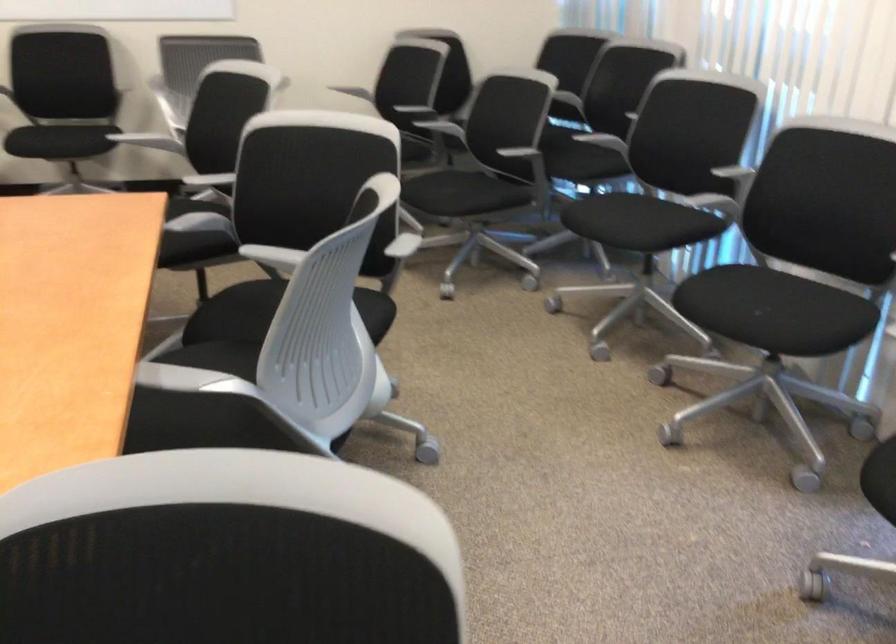
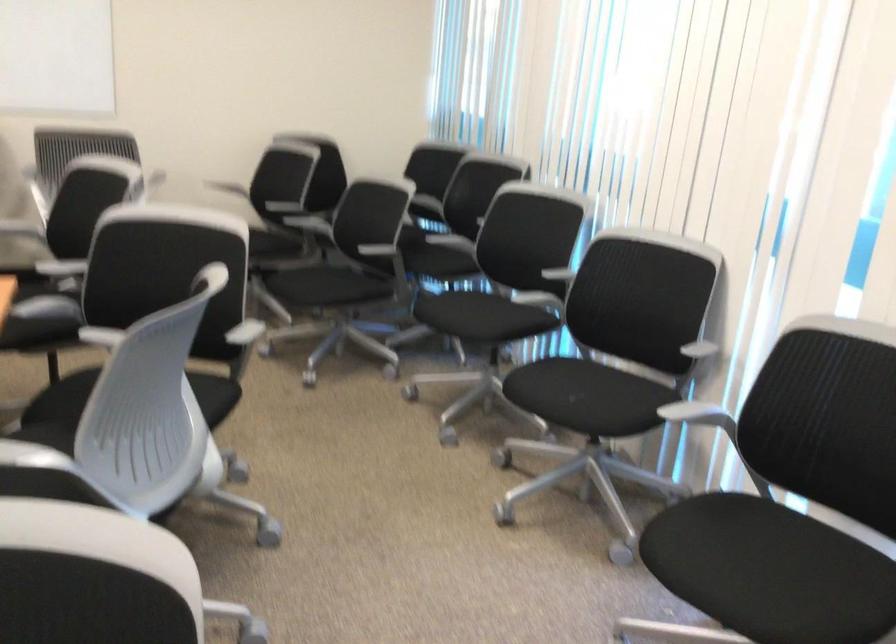
Question: How did the camera likely rotate?

Choices:
 (A) Left
 (B) Right
 (C) Up
 (D) Down

Answer: (B)